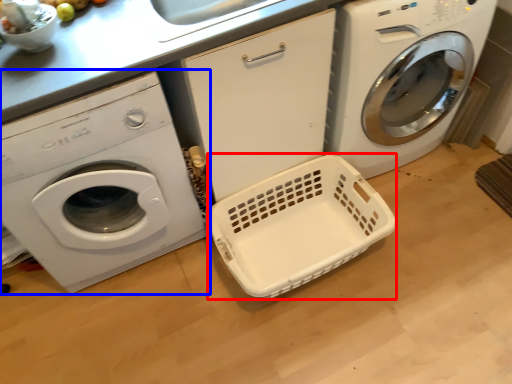
Question: Among these objects, which one is nearest to the camera, basket container (highlighted by a red box) or washing machine (highlighted by a blue box)?

Choices:
 (A) basket container
 (B) washing machine

Answer: (B)